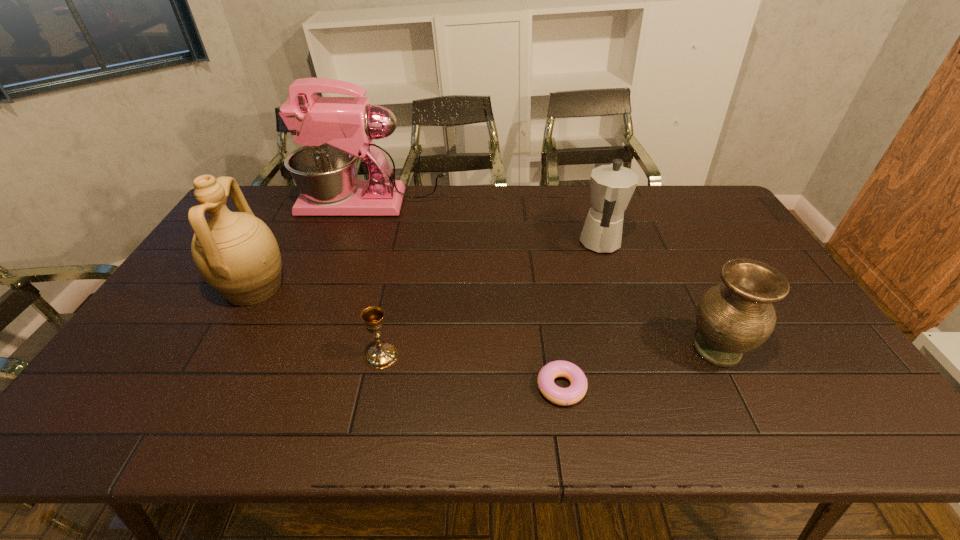
The width and height of the screenshot is (960, 540). In order to click on vacant space that's between the second tallest object and the mixer in this screenshot , I will do `click(314, 246)`.

Where is `free space between the vase and the second tallest object`? This screenshot has height=540, width=960. free space between the vase and the second tallest object is located at coordinates (485, 319).

In order to click on empty space that is in between the pitcher and the chalice in this screenshot , I will do [318, 322].

Locate an element on the screen. free spot between the second shortest object and the coffeepot is located at coordinates (492, 300).

Where is `free space between the fourth shortest object and the pitcher`? This screenshot has height=540, width=960. free space between the fourth shortest object and the pitcher is located at coordinates (427, 266).

This screenshot has width=960, height=540. Identify the location of free space between the second shortest object and the rightmost object. (549, 353).

This screenshot has height=540, width=960. In order to click on vacant area between the pitcher and the fifth object from left to right in this screenshot , I will do `click(427, 266)`.

In order to click on object that can be found as the closest to the doughnut in this screenshot , I will do `click(733, 318)`.

Locate which object ranks second in proximity to the tallest object. Please provide its 2D coordinates. Your answer should be formatted as a tuple, i.e. [(x, y)], where the tuple contains the x and y coordinates of a point satisfying the conditions above.

[(612, 186)]

This screenshot has height=540, width=960. Identify the location of free spot that satisfies the following two spatial constraints: 1. on the face of the rightmost object; 2. on the left side of the farthest object. (325, 350).